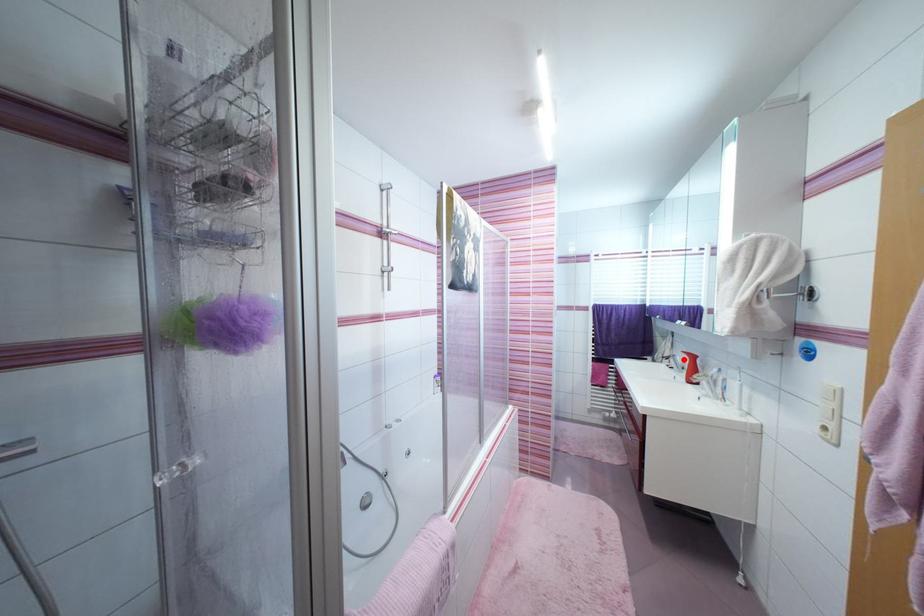
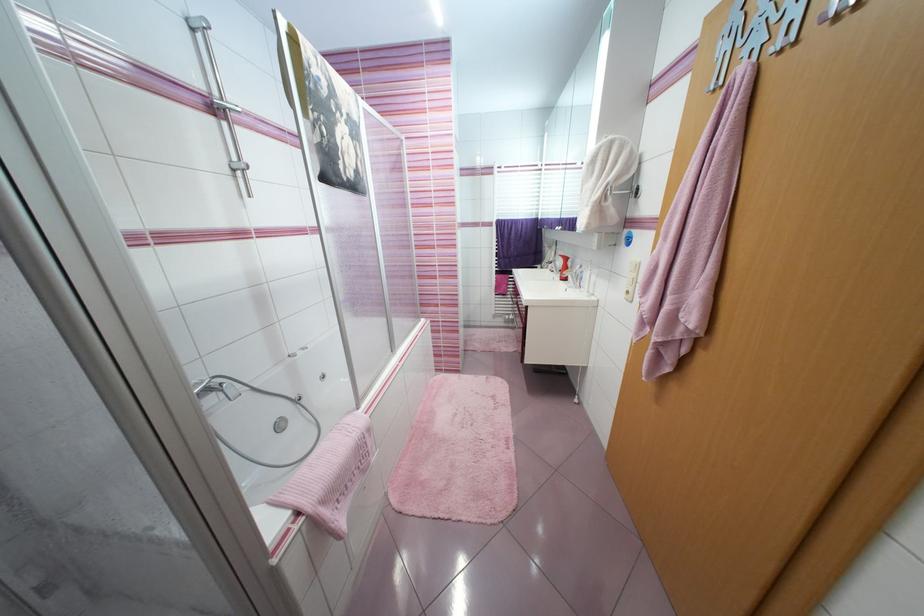
Where in the second image is the point corresponding to the highlighted location from the first image?

(563, 264)